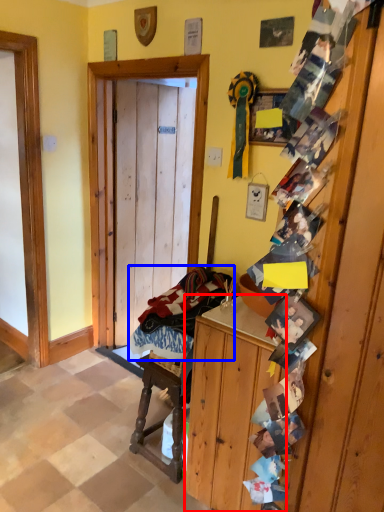
Question: Which point is further to the camera, cabinetry (highlighted by a red box) or laundry (highlighted by a blue box)?

Choices:
 (A) cabinetry
 (B) laundry

Answer: (B)